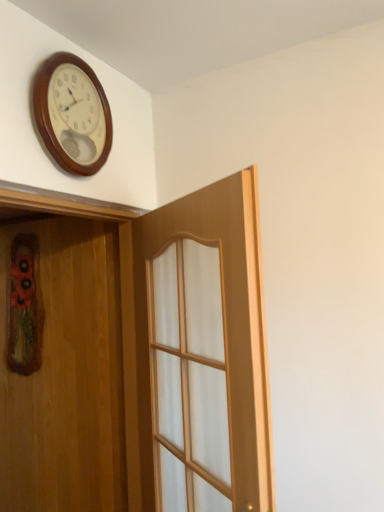
Question: Is wooden wall clock at upper left to the left or to the right of light wood door at center, acting as the second door starting from the left, in the image?

Choices:
 (A) right
 (B) left

Answer: (B)

Question: Looking at the image, does wooden wall clock at upper left seem bigger or smaller compared to light wood door at center, acting as the second door starting from the left?

Choices:
 (A) big
 (B) small

Answer: (B)

Question: Which object is the farthest from the wooden door at left, placed as the 2th door when sorted from right to left?

Choices:
 (A) light wood door at center, which is counted as the first door, starting from the right
 (B) wooden wall clock at upper left

Answer: (B)

Question: Estimate the real-world distances between objects in this image. Which object is farther from the wooden door at left, placed as the 2th door when sorted from right to left?

Choices:
 (A) wooden wall clock at upper left
 (B) light wood door at center, acting as the second door starting from the left

Answer: (A)